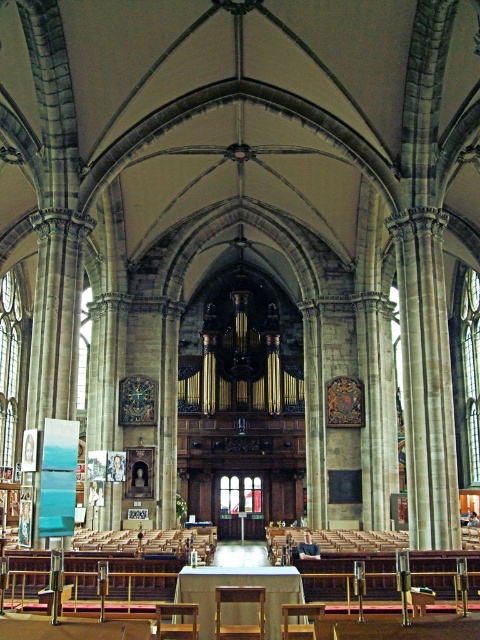
Who is positioned more to the left, wooden chair at lower center or wooden chair at center?

Positioned to the left is wooden chair at lower center.

In the scene shown: Can you confirm if wooden chair at lower center is positioned to the right of wooden chair at center?

In fact, wooden chair at lower center is to the left of wooden chair at center.

I want to click on wooden chair at lower center, so click(x=176, y=620).

I want to click on wooden chair at lower center, so click(x=176, y=620).

Between point (230, 589) and point (168, 634), which one is positioned in front?

Point (168, 634)

Is brown wooden chair at center to the right of wooden chair at lower center from the viewer's perspective?

Yes, brown wooden chair at center is to the right of wooden chair at lower center.

Is point (217, 618) closer to camera compared to point (177, 609)?

No, (217, 618) is behind (177, 609).

Where is `brown wooden chair at center`? Image resolution: width=480 pixels, height=640 pixels. brown wooden chair at center is located at coordinates (237, 602).

Which of these two, brown wooden chair at center or wooden chair at center, stands shorter?

wooden chair at center is shorter.

Who is positioned more to the right, brown wooden chair at center or wooden chair at center?

wooden chair at center

This screenshot has width=480, height=640. In order to click on brown wooden chair at center in this screenshot , I will do `click(237, 602)`.